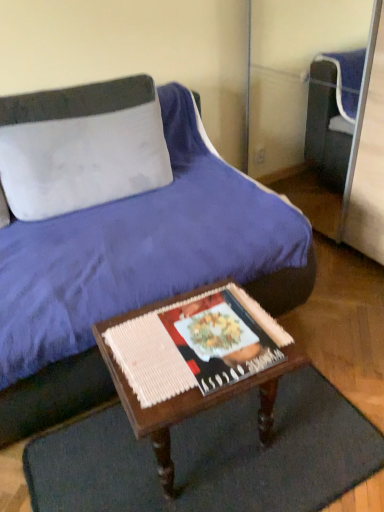
Question: Can you confirm if white fabric pillow at upper left is taller than dark brown woven mat at lower center?

Choices:
 (A) yes
 (B) no

Answer: (A)

Question: From the image's perspective, is white fabric pillow at upper left below dark brown woven mat at lower center?

Choices:
 (A) yes
 (B) no

Answer: (B)

Question: Considering the relative positions of white fabric pillow at upper left and dark brown woven mat at lower center in the image provided, is white fabric pillow at upper left to the left of dark brown woven mat at lower center from the viewer's perspective?

Choices:
 (A) no
 (B) yes

Answer: (B)

Question: Does white fabric pillow at upper left touch dark brown woven mat at lower center?

Choices:
 (A) yes
 (B) no

Answer: (B)

Question: Considering the relative sizes of white fabric pillow at upper left and dark brown woven mat at lower center in the image provided, is white fabric pillow at upper left bigger than dark brown woven mat at lower center?

Choices:
 (A) yes
 (B) no

Answer: (A)

Question: Is matte paper magazine at center taller or shorter than wooden table at center?

Choices:
 (A) short
 (B) tall

Answer: (A)

Question: Is matte paper magazine at center to the left or to the right of wooden table at center in the image?

Choices:
 (A) left
 (B) right

Answer: (B)

Question: In terms of width, does matte paper magazine at center look wider or thinner when compared to wooden table at center?

Choices:
 (A) wide
 (B) thin

Answer: (B)

Question: Is matte paper magazine at center inside or outside of wooden table at center?

Choices:
 (A) inside
 (B) outside

Answer: (A)

Question: From the image's perspective, is wooden table at center above or below dark brown woven mat at lower center?

Choices:
 (A) below
 (B) above

Answer: (B)

Question: Do you think wooden table at center is within dark brown woven mat at lower center, or outside of it?

Choices:
 (A) inside
 (B) outside

Answer: (B)

Question: In terms of width, does wooden table at center look wider or thinner when compared to dark brown woven mat at lower center?

Choices:
 (A) thin
 (B) wide

Answer: (A)

Question: Would you say wooden table at center is to the left or to the right of dark brown woven mat at lower center in the picture?

Choices:
 (A) right
 (B) left

Answer: (B)

Question: Is point (x=99, y=117) closer or farther from the camera than point (x=291, y=358)?

Choices:
 (A) closer
 (B) farther

Answer: (B)

Question: Considering their positions, is white fabric pillow at upper left located in front of or behind wooden table at center?

Choices:
 (A) behind
 (B) front

Answer: (A)